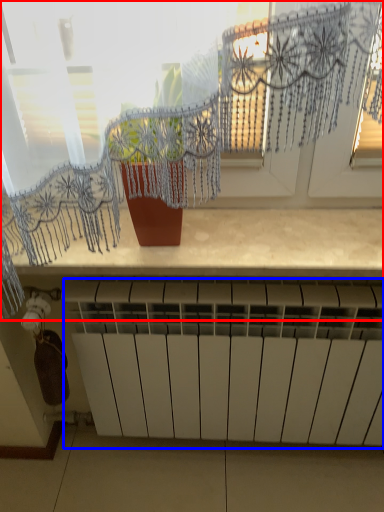
Question: Which of the following is the closest to the observer, window (highlighted by a red box) or radiator (highlighted by a blue box)?

Choices:
 (A) window
 (B) radiator

Answer: (A)